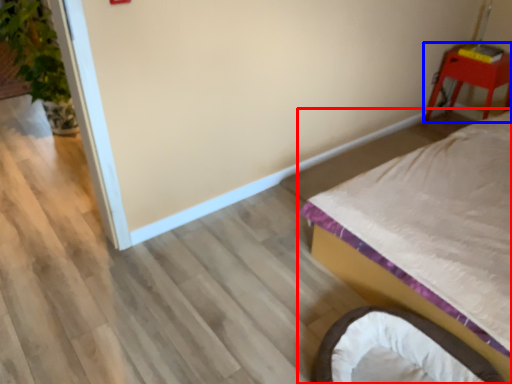
Question: Which point is further to the camera, bed (highlighted by a red box) or furniture (highlighted by a blue box)?

Choices:
 (A) bed
 (B) furniture

Answer: (B)